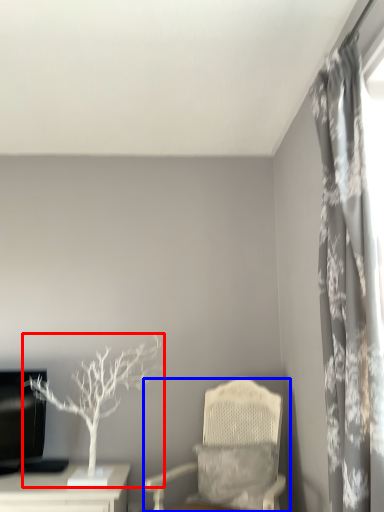
Question: Which object is further to the camera taking this photo, houseplant (highlighted by a red box) or chair (highlighted by a blue box)?

Choices:
 (A) houseplant
 (B) chair

Answer: (A)